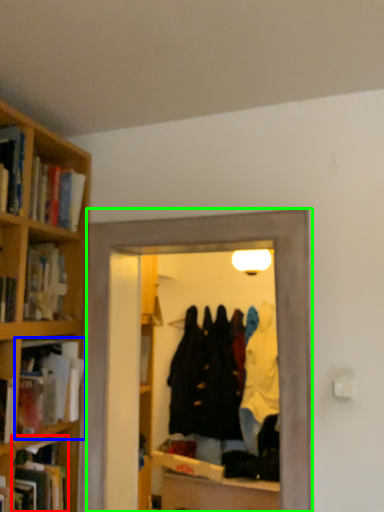
Question: Which object is positioned farthest from book (highlighted by a red box)? Select from book (highlighted by a blue box) and glass door (highlighted by a green box).

Choices:
 (A) book
 (B) glass door

Answer: (B)